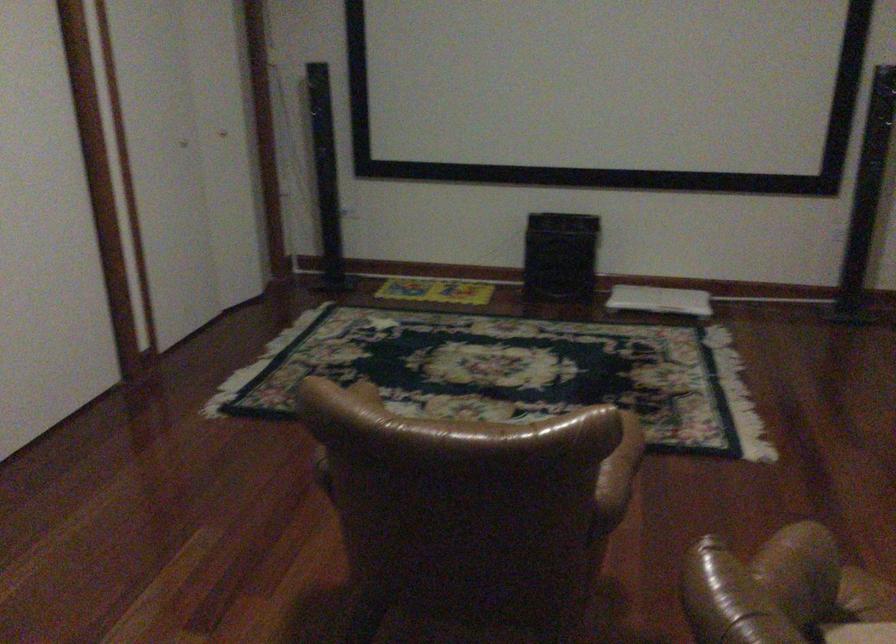
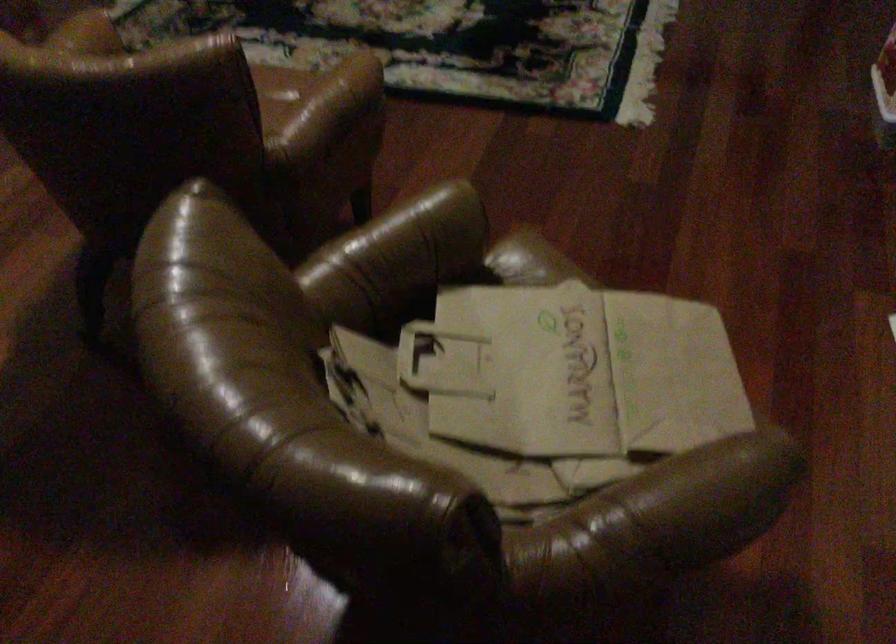
Question: Based on the continuous images, in which direction is the camera rotating? Reply with the corresponding letter.

Choices:
 (A) Left
 (B) Right
 (C) Up
 (D) Down

Answer: (D)